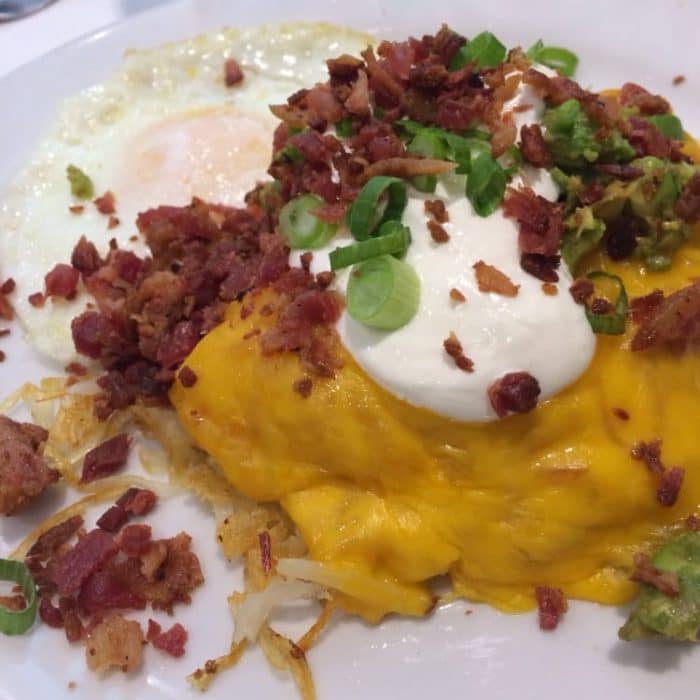
This screenshot has height=700, width=700. I want to click on light blue plate, so click(64, 71).